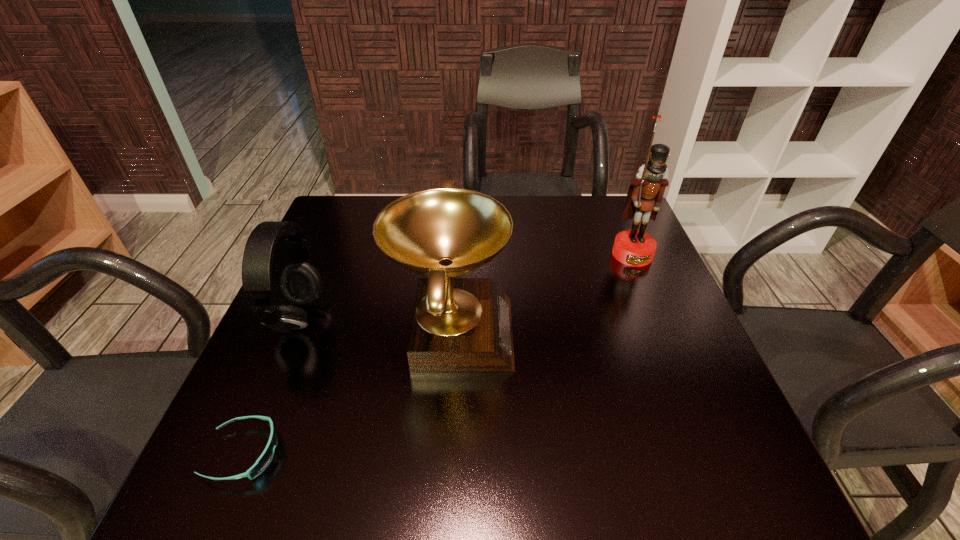
What are the coordinates of `vacant area at the right edge` in the screenshot? It's located at click(x=673, y=406).

This screenshot has height=540, width=960. In the image, there is a desktop. In order to click on vacant area at the far left corner in this screenshot , I will do pyautogui.click(x=354, y=208).

Identify the location of vacant point located between the second shortest object and the sunglasses. Image resolution: width=960 pixels, height=540 pixels. [271, 386].

The width and height of the screenshot is (960, 540). I want to click on vacant space in between the farthest object and the third object from left to right, so click(x=542, y=293).

Find the location of a particular element. This screenshot has height=540, width=960. blank region between the earphone and the shortest object is located at coordinates (271, 386).

The image size is (960, 540). What are the coordinates of `vacant point located between the second shortest object and the nearest object` in the screenshot? It's located at (271, 386).

Find the location of a particular element. vacant area that lies between the third tallest object and the nearest object is located at coordinates (271, 386).

This screenshot has width=960, height=540. Identify the location of vacant space that's between the award and the second shortest object. [x=375, y=325].

The height and width of the screenshot is (540, 960). Identify the location of empty space that is in between the third object from left to right and the earphone. (375, 325).

Identify the location of free spot between the nearest object and the third tallest object. The width and height of the screenshot is (960, 540). (271, 386).